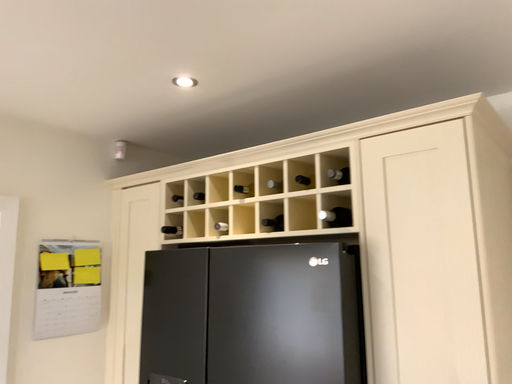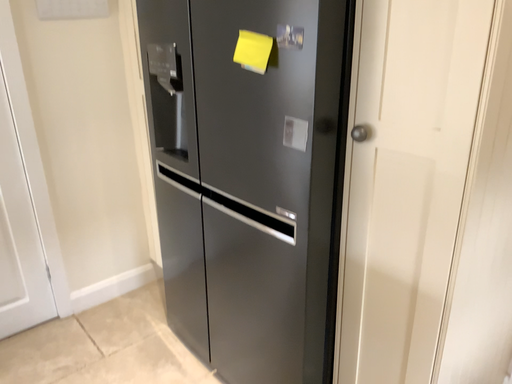
Question: How did the camera likely rotate when shooting the video?

Choices:
 (A) rotated right
 (B) rotated left

Answer: (B)